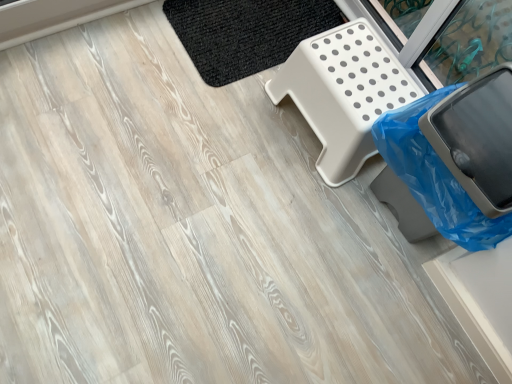
Find the location of a particular element. The image size is (512, 384). free spot to the left of white plastic step stool at upper right is located at coordinates (216, 110).